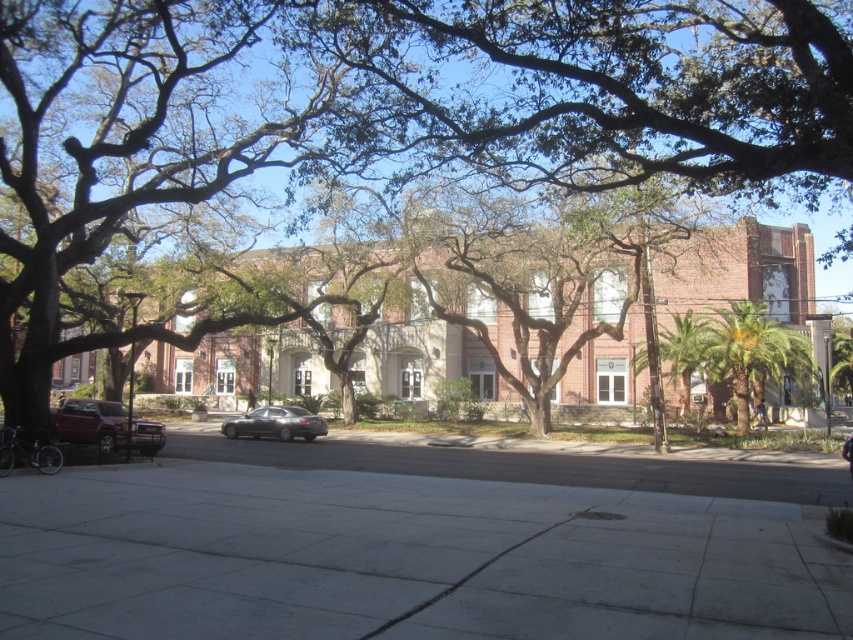
Consider the image. Does matte red car at lower left lie behind satin black sedan at center?

No, it is in front of satin black sedan at center.

The image size is (853, 640). I want to click on matte red car at lower left, so click(x=105, y=426).

Is point (93, 433) closer to camera compared to point (227, 429)?

Yes, point (93, 433) is closer to viewer.

This screenshot has width=853, height=640. Find the location of `matte red car at lower left`. matte red car at lower left is located at coordinates (105, 426).

Is point (589, 64) closer to viewer compared to point (260, 412)?

Yes, point (589, 64) is in front of point (260, 412).

Describe the element at coordinates (601, 88) in the screenshot. The height and width of the screenshot is (640, 853). I see `green leafy tree at center` at that location.

Which is in front, point (640, 115) or point (241, 417)?

Point (640, 115) is more forward.

Where is `green leafy tree at center`? green leafy tree at center is located at coordinates (601, 88).

Is point (618, 579) positioned after point (265, 432)?

No.

Who is lower down, gray concrete sidewalk at center or satin black sedan at center?

satin black sedan at center

Where is `gray concrete sidewalk at center`? The image size is (853, 640). gray concrete sidewalk at center is located at coordinates 401,557.